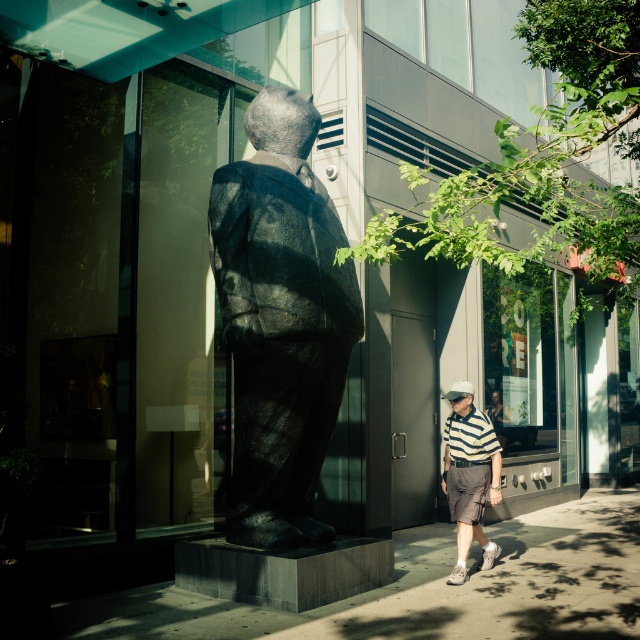
Question: Which object is the closest to the concrete sidewalk at center?

Choices:
 (A) white matte baseball hat at center
 (B) black textured statue at center

Answer: (A)

Question: Can you confirm if concrete sidewalk at center is positioned above white matte baseball hat at center?

Choices:
 (A) yes
 (B) no

Answer: (B)

Question: Which of the following is the closest to the observer?

Choices:
 (A) (566, 589)
 (B) (468, 422)

Answer: (A)

Question: Is striped cotton polo shirt at center thinner than white matte baseball hat at center?

Choices:
 (A) no
 (B) yes

Answer: (A)

Question: Which object is the closest to the concrete sidewalk at center?

Choices:
 (A) white matte baseball hat at center
 (B) striped cotton polo shirt at center

Answer: (B)

Question: Is black textured statue at center above striped cotton polo shirt at center?

Choices:
 (A) no
 (B) yes

Answer: (B)